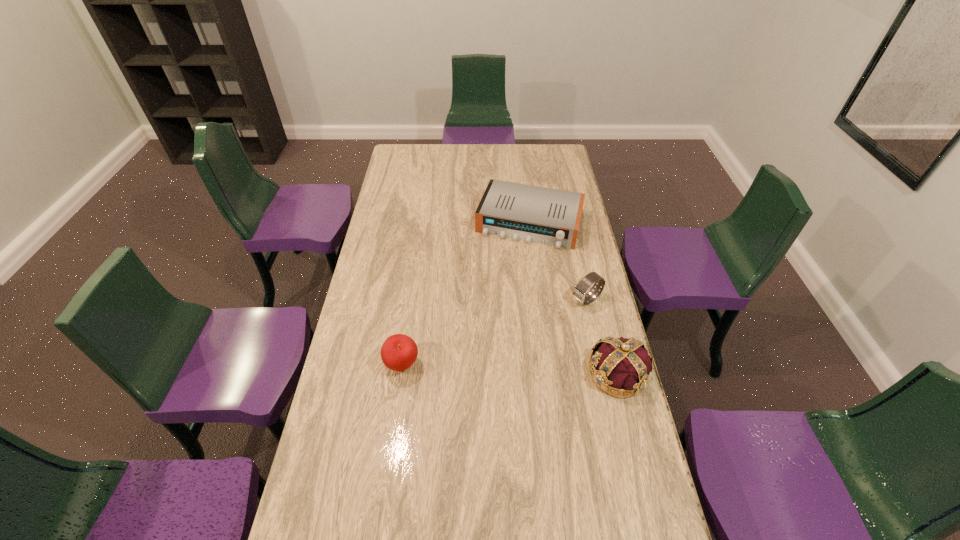
This screenshot has width=960, height=540. Identify the location of apple. (398, 352).

You are a GUI agent. You are given a task and a screenshot of the screen. Output one action in this format:
    pyautogui.click(x=<x>, y=<y>)
    Task: Click on the crown
    The height and width of the screenshot is (540, 960).
    Given the screenshot: What is the action you would take?
    coord(621,367)

The height and width of the screenshot is (540, 960). Find the location of `the third nearest object`. the third nearest object is located at coordinates (579, 292).

The height and width of the screenshot is (540, 960). In order to click on radio receiver in this screenshot , I will do `click(548, 216)`.

What are the coordinates of `the shortest object` in the screenshot? It's located at (548, 216).

At what (x,y) coordinates should I click in order to perform the action: click on vacant region located 0.120m on the back of the apple. Please return your answer as a coordinate pair (x, y). This screenshot has height=540, width=960. Looking at the image, I should click on (408, 321).

Find the location of a particular element. free space located on the front of the crown is located at coordinates (650, 507).

Where is `vacant space located 0.060m on the face of the watch`? The image size is (960, 540). vacant space located 0.060m on the face of the watch is located at coordinates (562, 314).

Find the location of a particular element. free space located on the face of the watch is located at coordinates (534, 331).

The image size is (960, 540). What are the coordinates of `vacant area located 0.350m on the face of the watch` in the screenshot? It's located at pos(497,354).